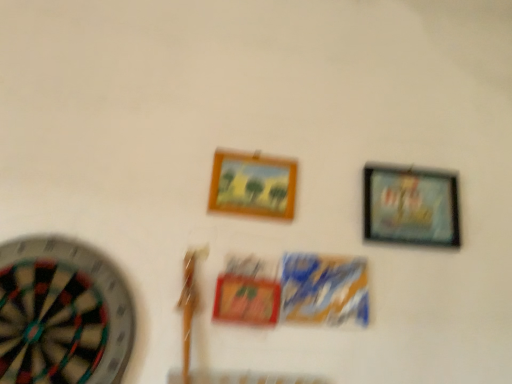
Question: In terms of width, does wooden frame at center, which is the second picture frame from right to left, look wider or thinner when compared to multicolored felt dartboard at left?

Choices:
 (A) wide
 (B) thin

Answer: (B)

Question: Would you say wooden frame at center, which is the second picture frame from right to left, is inside or outside multicolored felt dartboard at left?

Choices:
 (A) inside
 (B) outside

Answer: (B)

Question: Which object is positioned farthest from the wooden frame at center, which is counted as the first picture frame, starting from the left?

Choices:
 (A) metallic silver picture frame at upper right, the 1th picture frame positioned from the right
 (B) multicolored felt dartboard at left

Answer: (B)

Question: Based on their relative distances, which object is nearer to the metallic silver picture frame at upper right, the 2th picture frame positioned from the left?

Choices:
 (A) multicolored felt dartboard at left
 (B) wooden frame at center, which is the second picture frame from right to left

Answer: (B)